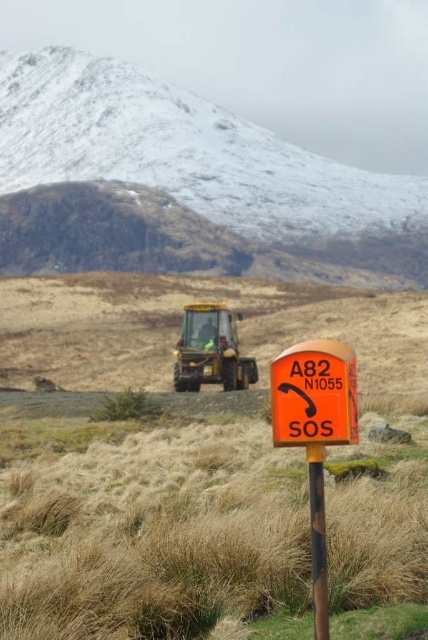
Question: Which object is the closest to the snowy rock mountain at upper left?

Choices:
 (A) orange plastic sign at lower right
 (B) yellow metallic tractor at center
 (C) brown wood post at center
 (D) orange matte/solid sos at lower right

Answer: (B)

Question: Which object is the closest to the yellow metallic tractor at center?

Choices:
 (A) snowy rock mountain at upper left
 (B) brown wood post at center

Answer: (B)

Question: From the image, what is the correct spatial relationship of orange plastic sign at lower right in relation to yellow metallic tractor at center?

Choices:
 (A) above
 (B) below

Answer: (A)

Question: From the image, what is the correct spatial relationship of snowy rock mountain at upper left in relation to orange plastic sign at lower right?

Choices:
 (A) right
 (B) left

Answer: (B)

Question: Does snowy rock mountain at upper left appear on the left side of orange matte/solid sos at lower right?

Choices:
 (A) yes
 (B) no

Answer: (A)

Question: Which point is farther to the camera?

Choices:
 (A) (214, 340)
 (B) (118, 106)
 (C) (321, 353)
 (D) (344, 378)

Answer: (B)